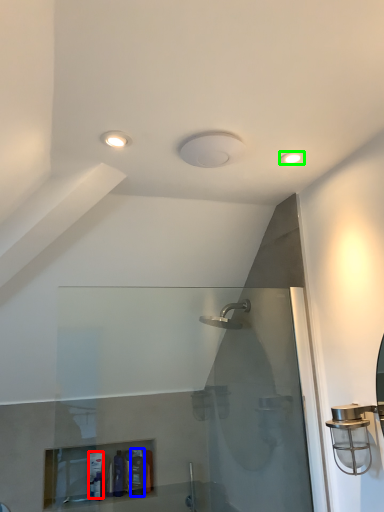
Question: Which is farther away from toiletry (highlighted by a red box)? toiletry (highlighted by a blue box) or light fixture (highlighted by a green box)?

Choices:
 (A) toiletry
 (B) light fixture

Answer: (B)